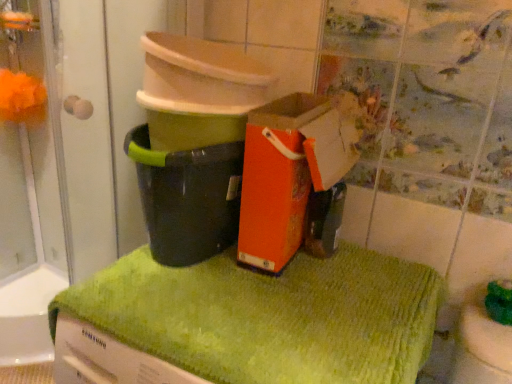
Question: Can we say orange paper bag at center lies outside orange fuzzy ball at upper left?

Choices:
 (A) no
 (B) yes

Answer: (B)

Question: Does orange paper bag at center have a smaller size compared to orange fuzzy ball at upper left?

Choices:
 (A) no
 (B) yes

Answer: (A)

Question: Is orange paper bag at center not close to orange fuzzy ball at upper left?

Choices:
 (A) yes
 (B) no

Answer: (A)

Question: Is orange fuzzy ball at upper left located within orange paper bag at center?

Choices:
 (A) yes
 (B) no

Answer: (B)

Question: Does orange paper bag at center have a larger size compared to orange fuzzy ball at upper left?

Choices:
 (A) yes
 (B) no

Answer: (A)

Question: Is black plastic bucket at center inside or outside of orange fuzzy ball at upper left?

Choices:
 (A) inside
 (B) outside

Answer: (B)

Question: Is black plastic bucket at center taller or shorter than orange fuzzy ball at upper left?

Choices:
 (A) short
 (B) tall

Answer: (B)

Question: Looking at the image, does black plastic bucket at center seem bigger or smaller compared to orange fuzzy ball at upper left?

Choices:
 (A) big
 (B) small

Answer: (A)

Question: Relative to orange fuzzy ball at upper left, is black plastic bucket at center in front or behind?

Choices:
 (A) behind
 (B) front

Answer: (B)

Question: From their relative heights in the image, would you say orange fuzzy ball at upper left is taller or shorter than black plastic bucket at center?

Choices:
 (A) short
 (B) tall

Answer: (A)

Question: Is orange fuzzy ball at upper left spatially inside black plastic bucket at center, or outside of it?

Choices:
 (A) inside
 (B) outside

Answer: (B)

Question: From a real-world perspective, is orange fuzzy ball at upper left above or below black plastic bucket at center?

Choices:
 (A) above
 (B) below

Answer: (A)

Question: Is point (18, 79) closer or farther from the camera than point (204, 225)?

Choices:
 (A) farther
 (B) closer

Answer: (A)

Question: Would you say orange paper bag at center is to the left or to the right of orange fuzzy ball at upper left in the picture?

Choices:
 (A) right
 (B) left

Answer: (A)

Question: Which is correct: orange paper bag at center is inside orange fuzzy ball at upper left, or outside of it?

Choices:
 (A) inside
 (B) outside

Answer: (B)